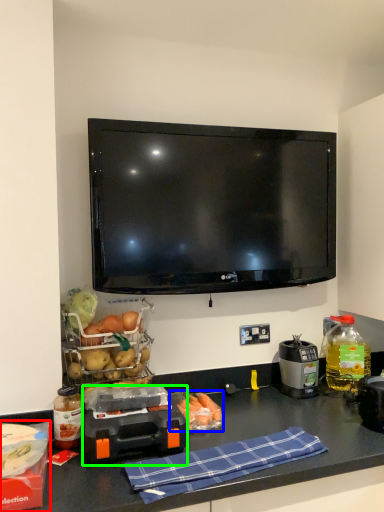
Question: Considering the real-world distances, which object is closest to box (highlighted by a red box)? food (highlighted by a blue box) or appliance (highlighted by a green box).

Choices:
 (A) food
 (B) appliance

Answer: (B)